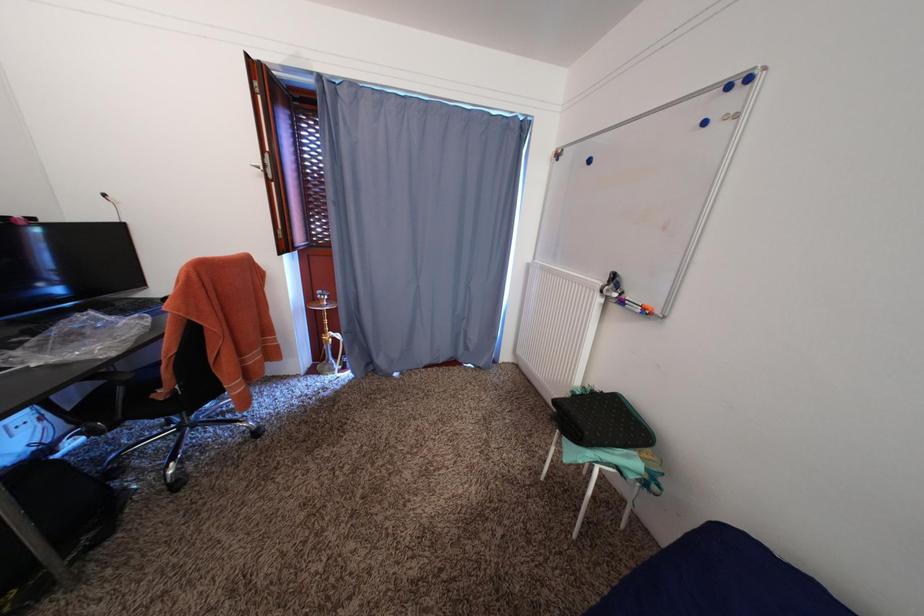
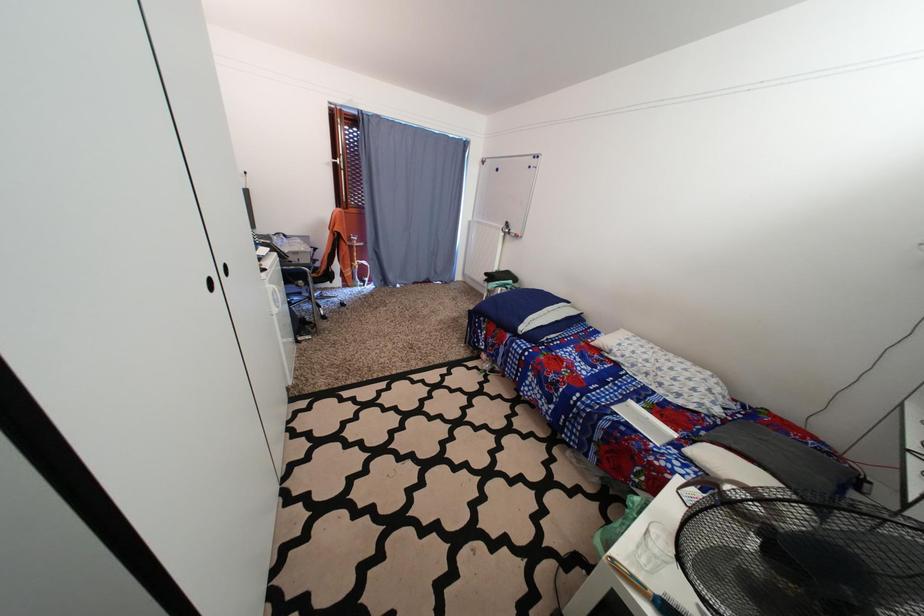
The images are taken continuously from a first-person perspective. In which direction are you moving?

The cameraman moved toward left, backward.